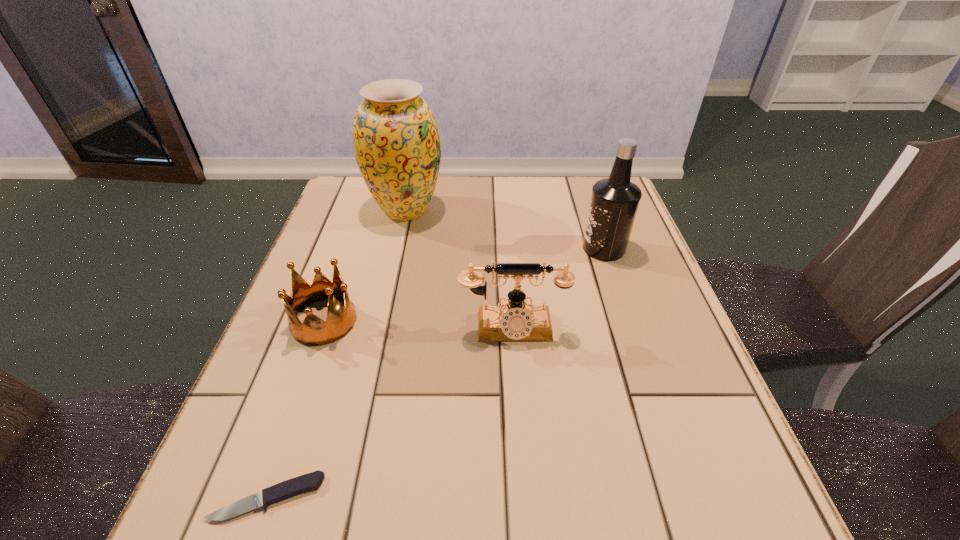
You are a GUI agent. You are given a task and a screenshot of the screen. Output one action in this format:
    pyautogui.click(x=<x>, y=<y>)
    Task: Click on the unoccupied position between the telephone and the vase
    The image size is (960, 540).
    Given the screenshot: What is the action you would take?
    pyautogui.click(x=459, y=269)

Locate an element on the screen. vacant space that is in between the second tallest object and the farthest object is located at coordinates (505, 229).

Find the location of a particular element. This screenshot has height=540, width=960. blank region between the third tallest object and the farthest object is located at coordinates (459, 269).

Find the location of a particular element. The height and width of the screenshot is (540, 960). vacant region between the second object from right to left and the vase is located at coordinates (459, 269).

Locate an element on the screen. vacant area that lies between the vase and the nearest object is located at coordinates (337, 353).

Where is `free spot between the nearest object and the farthest object`? free spot between the nearest object and the farthest object is located at coordinates (337, 353).

At what (x,y) coordinates should I click in order to perform the action: click on vacant area that lies between the farthest object and the second farthest object. Please return your answer as a coordinate pair (x, y). Looking at the image, I should click on (505, 229).

The image size is (960, 540). What are the coordinates of `empty space between the shortest object and the fourth object from left to right` in the screenshot? It's located at (390, 414).

At what (x,y) coordinates should I click in order to perform the action: click on vacant space that's between the rightmost object and the farthest object. Please return your answer as a coordinate pair (x, y). Looking at the image, I should click on (505, 229).

Find the location of a particular element. This screenshot has width=960, height=540. object that can be found as the third closest to the vase is located at coordinates (614, 202).